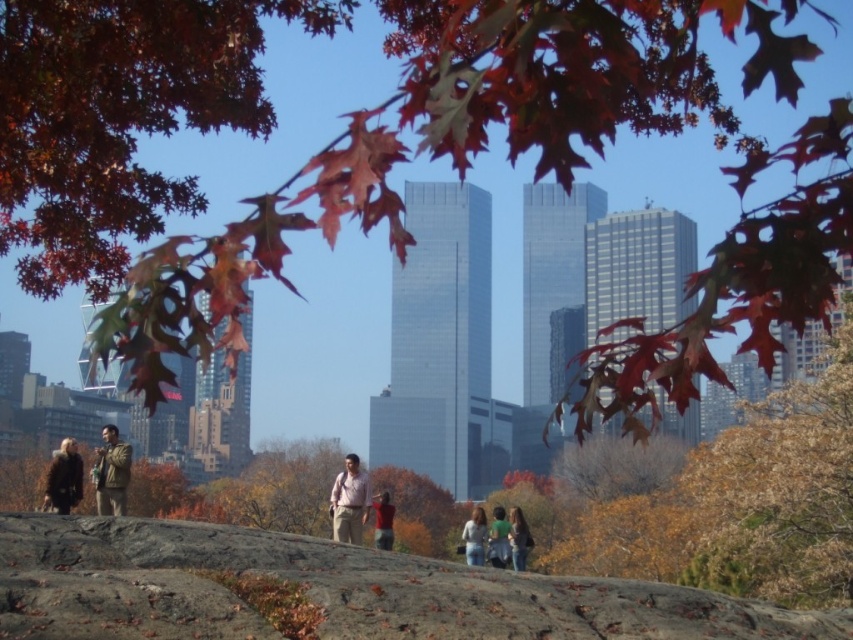
Question: Is camouflage jacket at lower left to the right of denim jeans at center from the viewer's perspective?

Choices:
 (A) no
 (B) yes

Answer: (A)

Question: Among these objects, which one is farthest from the camera?

Choices:
 (A) light brown leather jacket at center
 (B) dark brown fur coat at lower left
 (C) green matte shirt at center

Answer: (C)

Question: Can you confirm if matte pink shirt at center is positioned to the right of light brown hair at center?

Choices:
 (A) yes
 (B) no

Answer: (B)

Question: Which point appears closest to the camera in this image?

Choices:
 (A) (206, 525)
 (B) (115, 458)
 (C) (503, 540)

Answer: (A)

Question: Does shiny red maple leaf at upper center appear on the left side of light brown leather jacket at center?

Choices:
 (A) no
 (B) yes

Answer: (A)

Question: Among these objects, which one is farthest from the camera?

Choices:
 (A) green matte shirt at center
 (B) denim jeans at center
 (C) camouflage jacket at lower left

Answer: (A)